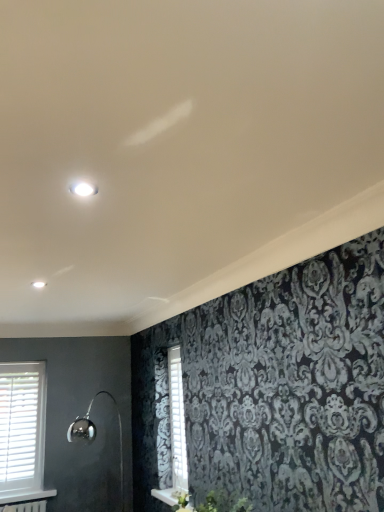
Question: Is polished chrome shower at lower left aimed at white wooden shutter at center?

Choices:
 (A) yes
 (B) no

Answer: (B)

Question: From the image's perspective, is polished chrome shower at lower left above white wooden shutter at center?

Choices:
 (A) yes
 (B) no

Answer: (B)

Question: From the image's perspective, is polished chrome shower at lower left beneath white wooden shutter at center?

Choices:
 (A) no
 (B) yes

Answer: (B)

Question: Considering the relative sizes of polished chrome shower at lower left and white wooden shutter at center in the image provided, is polished chrome shower at lower left taller than white wooden shutter at center?

Choices:
 (A) yes
 (B) no

Answer: (A)

Question: Is polished chrome shower at lower left positioned in front of white wooden shutter at center?

Choices:
 (A) yes
 (B) no

Answer: (A)

Question: Considering the positions of white wooden shutter at center and polished chrome shower at lower left in the image, is white wooden shutter at center bigger or smaller than polished chrome shower at lower left?

Choices:
 (A) big
 (B) small

Answer: (B)

Question: Is white wooden shutter at center inside the boundaries of polished chrome shower at lower left, or outside?

Choices:
 (A) inside
 (B) outside

Answer: (B)

Question: Looking at their shapes, would you say white wooden shutter at center is wider or thinner than polished chrome shower at lower left?

Choices:
 (A) wide
 (B) thin

Answer: (B)

Question: Is point (183, 437) positioned closer to the camera than point (72, 440)?

Choices:
 (A) farther
 (B) closer

Answer: (B)

Question: Does point tap(120, 477) appear closer or farther from the camera than point tap(170, 412)?

Choices:
 (A) farther
 (B) closer

Answer: (A)

Question: From the image's perspective, is polished chrome shower at lower left positioned above or below white wooden shutter at center?

Choices:
 (A) below
 (B) above

Answer: (A)

Question: Relative to white wooden shutter at center, is polished chrome shower at lower left in front or behind?

Choices:
 (A) front
 (B) behind

Answer: (A)

Question: Is polished chrome shower at lower left spatially inside white wooden shutter at center, or outside of it?

Choices:
 (A) outside
 (B) inside

Answer: (A)

Question: Considering the positions of white wooden shutter at center and white wooden window at lower left in the image, is white wooden shutter at center wider or thinner than white wooden window at lower left?

Choices:
 (A) wide
 (B) thin

Answer: (B)

Question: Is white wooden shutter at center situated inside white wooden window at lower left or outside?

Choices:
 (A) outside
 (B) inside

Answer: (A)